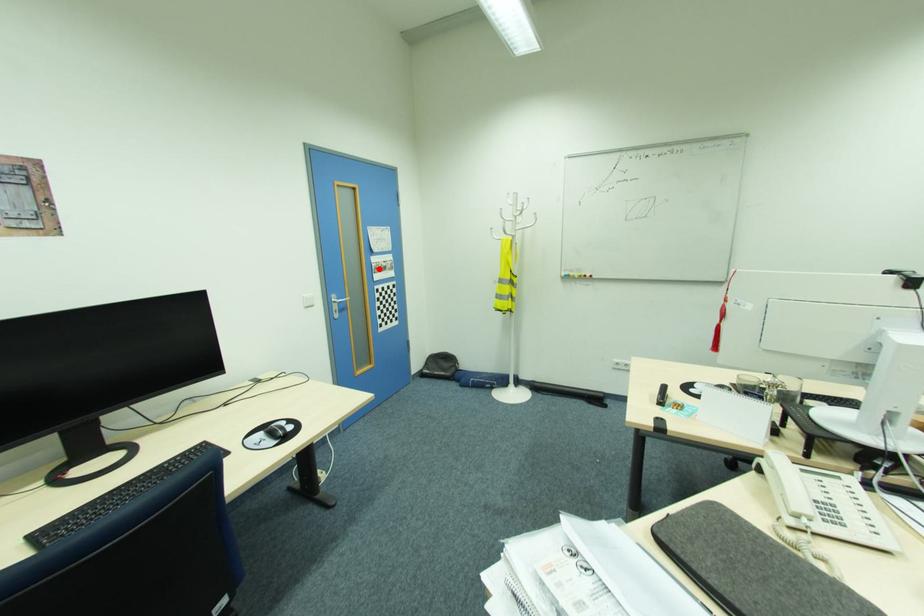
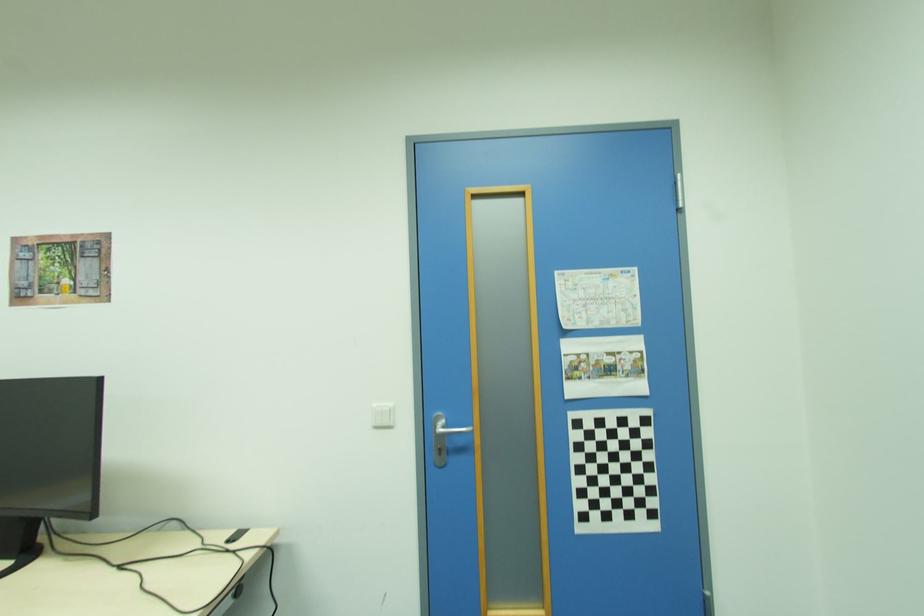
Question: I am providing you with two images of the same scene from different viewpoints. A red point is shown in image1. For the corresponding object point in image2, is it positioned nearer or farther from the camera?

Choices:
 (A) Nearer
 (B) Farther

Answer: (B)